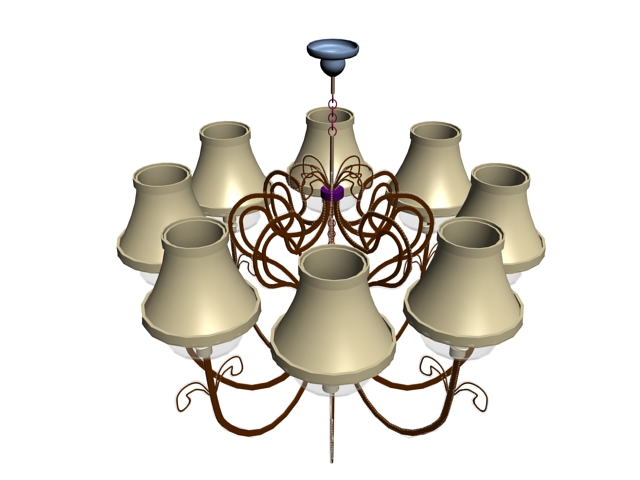
At what (x,y) coordinates should I click in order to perform the action: click on white translucent glass. Please return your answer as a coordinate pair (x, y). Looking at the image, I should click on (436, 220), (445, 347), (509, 273), (312, 387), (212, 348), (156, 275), (246, 215), (346, 201).